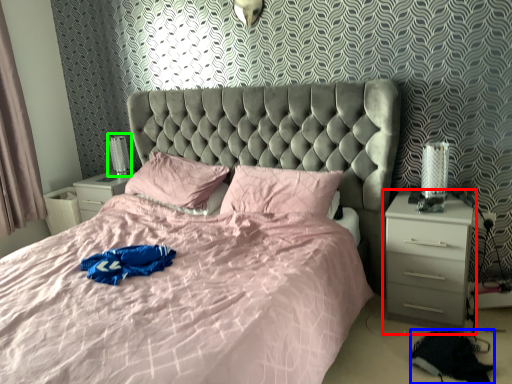
Question: Considering the real-world distances, which object is farthest from nightstand (highlighted by a red box)? material (highlighted by a blue box) or table lamp (highlighted by a green box)?

Choices:
 (A) material
 (B) table lamp

Answer: (B)